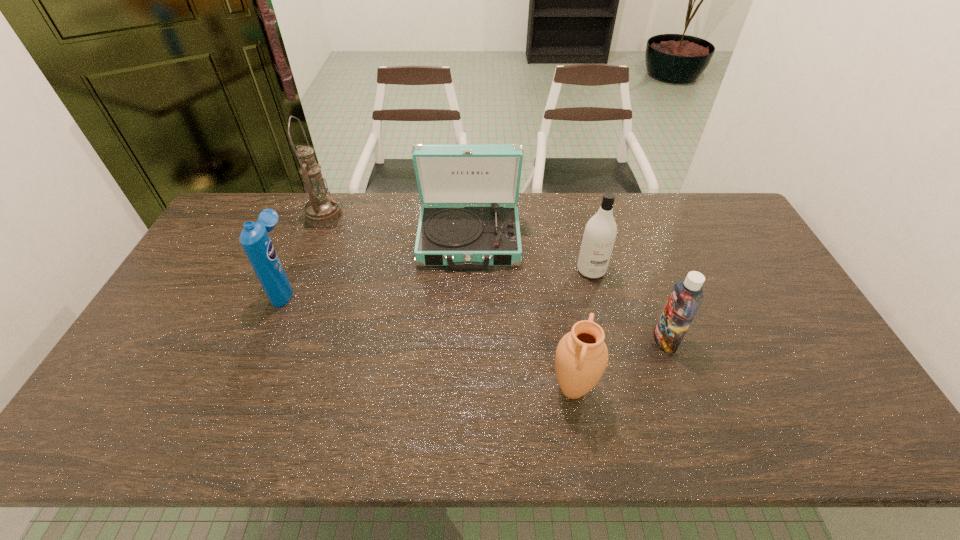
The width and height of the screenshot is (960, 540). I want to click on vacant region at the near edge, so click(x=663, y=440).

This screenshot has height=540, width=960. In order to click on free space at the left edge of the desktop in this screenshot , I will do click(x=203, y=333).

At what (x,y) coordinates should I click in order to perform the action: click on blank space at the far right corner of the desktop. Please return your answer as a coordinate pair (x, y). Image resolution: width=960 pixels, height=540 pixels. Looking at the image, I should click on (734, 215).

Locate an element on the screen. The image size is (960, 540). vacant area that lies between the third object from left to right and the nearest object is located at coordinates (520, 314).

I want to click on vacant region between the leftmost shampoo and the fourth object from right to left, so click(377, 264).

Find the location of a particular element. vacant area that lies between the urn and the leftmost shampoo is located at coordinates (429, 339).

You are a GUI agent. You are given a task and a screenshot of the screen. Output one action in this format:
    pyautogui.click(x=<x>, y=<y>)
    Task: Click on the vacant space that's between the nearest object and the third object from left to right
    The width and height of the screenshot is (960, 540).
    Given the screenshot: What is the action you would take?
    pyautogui.click(x=520, y=314)

I want to click on vacant area that lies between the leftmost shampoo and the nearest object, so click(429, 339).

Where is `empty space between the oil lamp and the rightmost object`? This screenshot has height=540, width=960. empty space between the oil lamp and the rightmost object is located at coordinates (494, 278).

The image size is (960, 540). In order to click on vacant area that lies between the tallest object and the leftmost shampoo in this screenshot , I will do `click(305, 252)`.